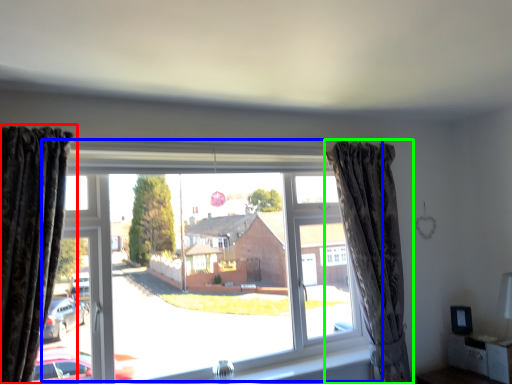
Question: Considering the real-world distances, which object is farthest from curtain (highlighted by a red box)? window (highlighted by a blue box) or curtain (highlighted by a green box)?

Choices:
 (A) window
 (B) curtain

Answer: (B)